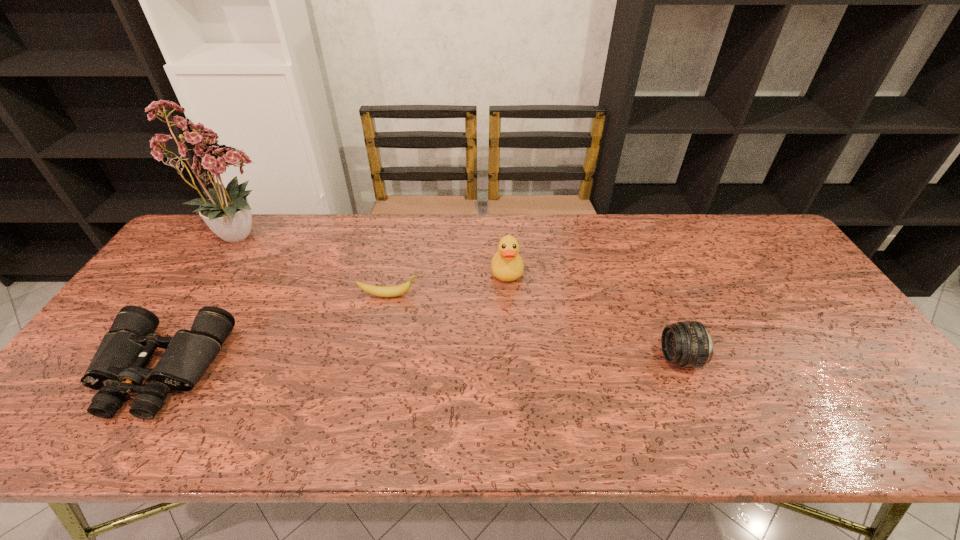
The width and height of the screenshot is (960, 540). Identify the location of empty location between the telephoto lens and the third nearest object. (535, 327).

The image size is (960, 540). I want to click on free space between the telephoto lens and the binoculars, so coord(420,364).

Locate an element on the screen. The width and height of the screenshot is (960, 540). free spot between the third object from left to right and the rightmost object is located at coordinates (535, 327).

The width and height of the screenshot is (960, 540). Identify the location of vacant point located between the binoculars and the fourth nearest object. (334, 321).

This screenshot has width=960, height=540. I want to click on free spot between the third object from right to left and the second farthest object, so click(x=448, y=284).

Identify the location of unoccupied position between the fourth nearest object and the banana. This screenshot has width=960, height=540. (448, 284).

What are the coordinates of `free spot between the telephoto lens and the tallest object` in the screenshot? It's located at (461, 296).

Identify which object is the closest to the flower arrangement. Please provide its 2D coordinates. Your answer should be formatted as a tuple, i.e. [(x, y)], where the tuple contains the x and y coordinates of a point satisfying the conditions above.

[(117, 368)]

Identify which object is located as the nearest to the second object from right to left. Please provide its 2D coordinates. Your answer should be formatted as a tuple, i.e. [(x, y)], where the tuple contains the x and y coordinates of a point satisfying the conditions above.

[(381, 291)]

Identify the location of vacant area in the image that satisfies the following two spatial constraints: 1. at the stem of the third object from right to left; 2. through the eyepieces of the binoculars. (374, 370).